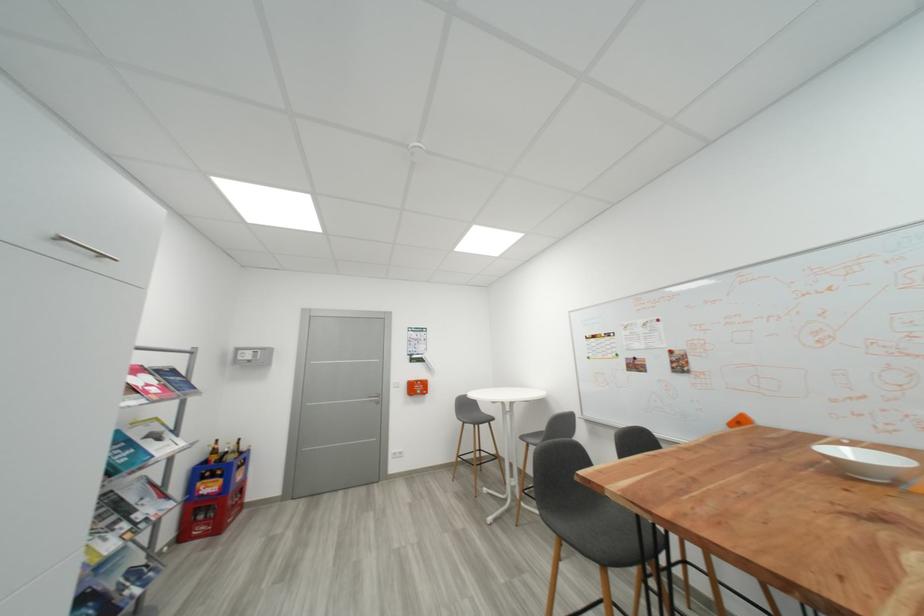
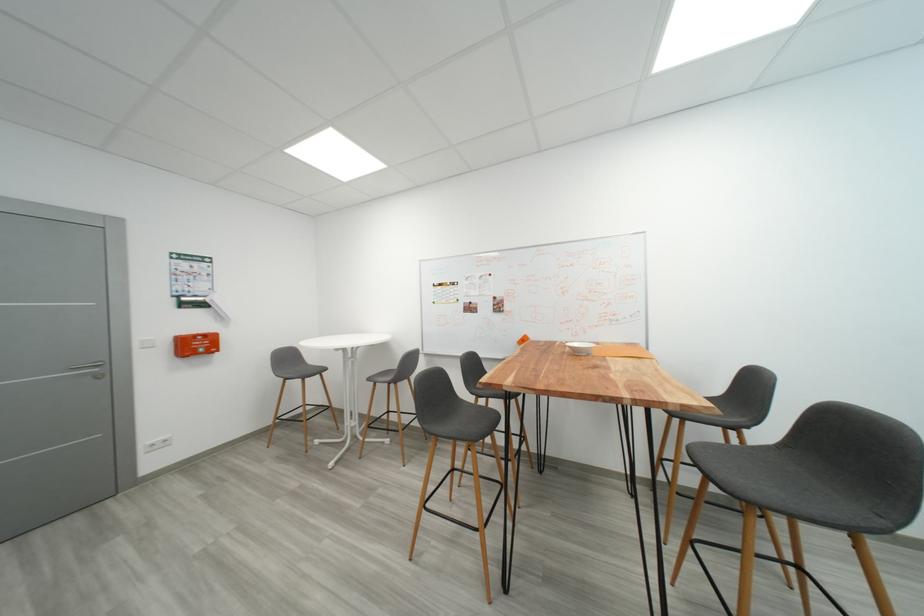
Question: The images are taken continuously from a first-person perspective. In which direction is your viewpoint rotating?

Choices:
 (A) Left
 (B) Right
 (C) Up
 (D) Down

Answer: (B)